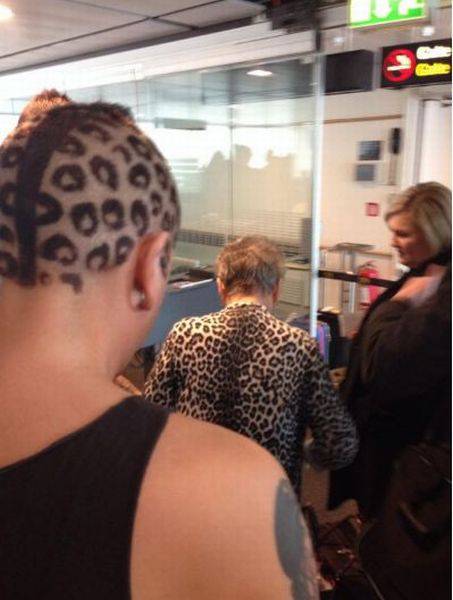
Locate an element on the screen. Image resolution: width=453 pixels, height=600 pixels. no smoking sign is located at coordinates (409, 56).